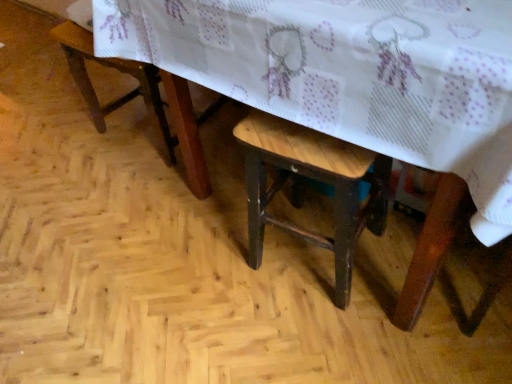
You are a GUI agent. You are given a task and a screenshot of the screen. Output one action in this format:
    pyautogui.click(x=<x>, y=<y>)
    Task: Click on the vacant area that is in front of wooden stool at lower left
    
    Given the screenshot: What is the action you would take?
    pyautogui.click(x=150, y=197)